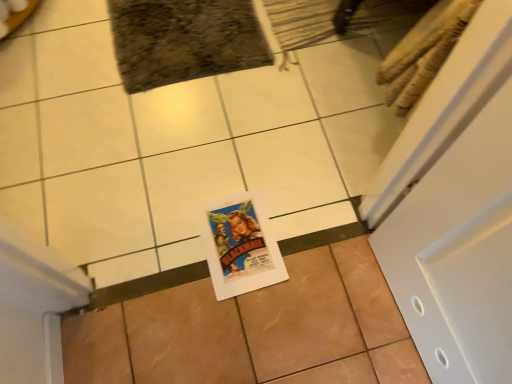
Question: From a real-world perspective, is brown glossy tile at center, placed as the first ceramic tile when sorted from top to bottom, above or below brown glossy tile at center, which ranks as the 2th ceramic tile in top-to-bottom order?

Choices:
 (A) below
 (B) above

Answer: (B)

Question: Choose the correct answer: Is brown glossy tile at center, placed as the first ceramic tile when sorted from top to bottom, inside brown glossy tile at center, which ranks as the 1th ceramic tile in bottom-to-top order, or outside it?

Choices:
 (A) outside
 (B) inside

Answer: (A)

Question: Is point (48, 139) closer or farther from the camera than point (278, 319)?

Choices:
 (A) farther
 (B) closer

Answer: (A)

Question: Would you say brown glossy tile at center, which ranks as the 2th ceramic tile in top-to-bottom order, is inside or outside brown glossy tile at center, placed as the first ceramic tile when sorted from top to bottom?

Choices:
 (A) inside
 (B) outside

Answer: (B)

Question: Considering their positions, is brown glossy tile at center, which ranks as the 1th ceramic tile in bottom-to-top order, located in front of or behind brown glossy tile at center, which ranks as the second ceramic tile in bottom-to-top order?

Choices:
 (A) front
 (B) behind

Answer: (A)

Question: In terms of size, does brown glossy tile at center, which ranks as the 1th ceramic tile in bottom-to-top order, appear bigger or smaller than brown glossy tile at center, placed as the first ceramic tile when sorted from top to bottom?

Choices:
 (A) big
 (B) small

Answer: (B)

Question: In terms of height, does brown glossy tile at center, which ranks as the 1th ceramic tile in bottom-to-top order, look taller or shorter compared to brown glossy tile at center, placed as the first ceramic tile when sorted from top to bottom?

Choices:
 (A) tall
 (B) short

Answer: (B)